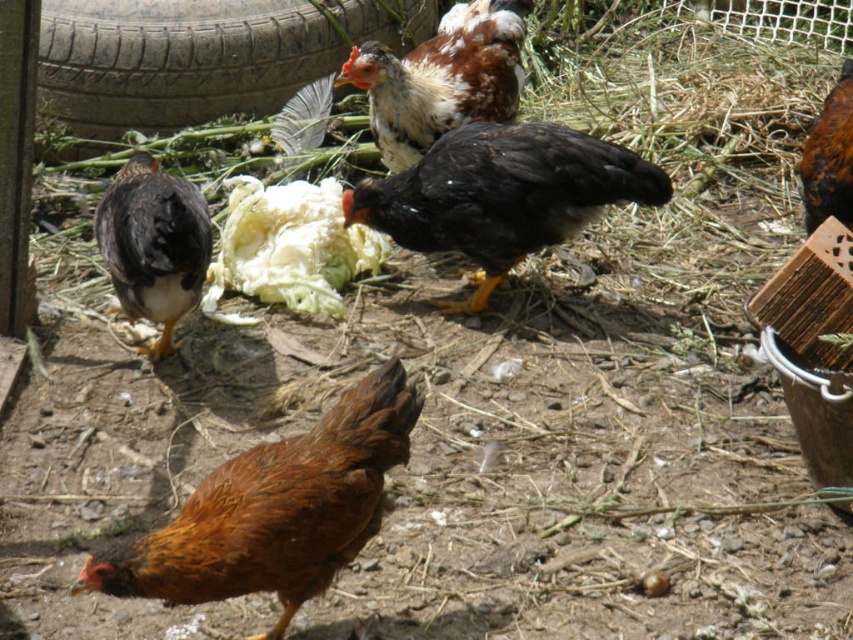
Question: Can you confirm if brown feathered chicken at lower center is positioned above black matte chicken at center?

Choices:
 (A) yes
 (B) no

Answer: (B)

Question: Which is nearer to the black matte chicken at center?

Choices:
 (A) matte black chicken at left
 (B) rubber tire at upper left
 (C) brown feathered chicken at right
 (D) white crisp cabbage at center

Answer: (D)

Question: Which object is the closest to the white crisp cabbage at center?

Choices:
 (A) black matte chicken at center
 (B) brown speckled feathers at center
 (C) rubber tire at upper left

Answer: (A)

Question: Observing the image, what is the correct spatial positioning of brown speckled feathers at center in reference to white crisp cabbage at center?

Choices:
 (A) left
 (B) right

Answer: (B)

Question: In this image, where is black matte chicken at center located relative to brown speckled feathers at center?

Choices:
 (A) above
 (B) below

Answer: (B)

Question: Which of the following is the closest to the observer?

Choices:
 (A) black matte chicken at center
 (B) white crisp cabbage at center

Answer: (A)